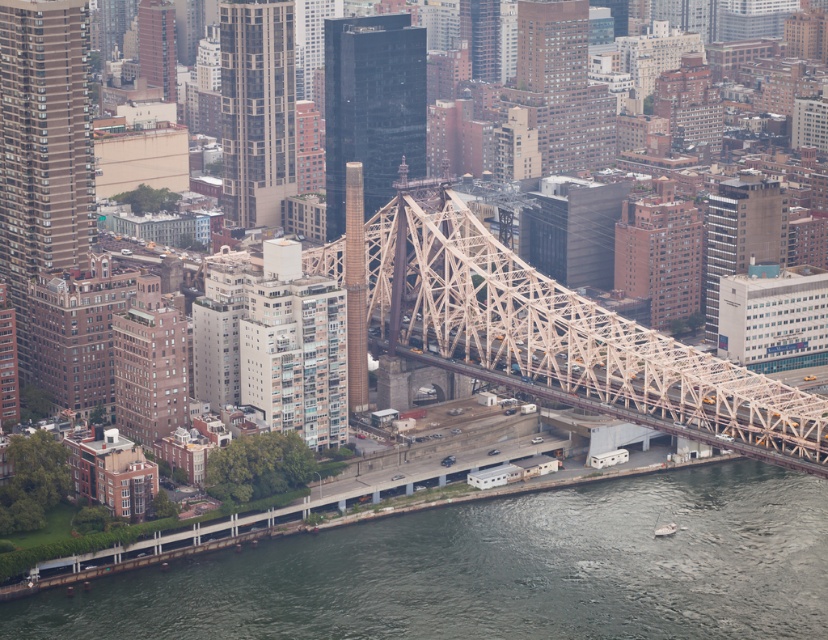
Question: Which point is farther from the camera taking this photo?

Choices:
 (A) (745, 403)
 (B) (347, 557)

Answer: (A)

Question: Which point is closer to the camera?

Choices:
 (A) (277, 540)
 (B) (492, 307)

Answer: (B)

Question: Can you confirm if greenish-gray water at lower center is bigger than white metal bridge at center?

Choices:
 (A) no
 (B) yes

Answer: (A)

Question: Is greenish-gray water at lower center closer to the viewer compared to white metal bridge at center?

Choices:
 (A) yes
 (B) no

Answer: (B)

Question: Is greenish-gray water at lower center positioned in front of white metal bridge at center?

Choices:
 (A) yes
 (B) no

Answer: (B)

Question: Which point is closer to the camera?

Choices:
 (A) white metal bridge at center
 (B) greenish-gray water at lower center

Answer: (A)